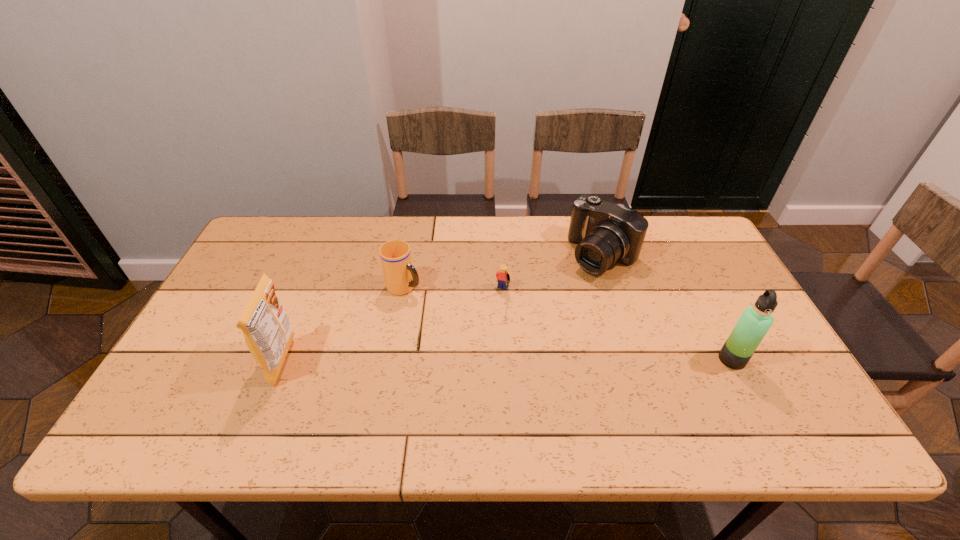
This screenshot has height=540, width=960. In order to click on free space that satisfies the following two spatial constraints: 1. on the back side of the fourth object from right to left; 2. on the right side of the fourth object from left to right in this screenshot , I will do `click(410, 255)`.